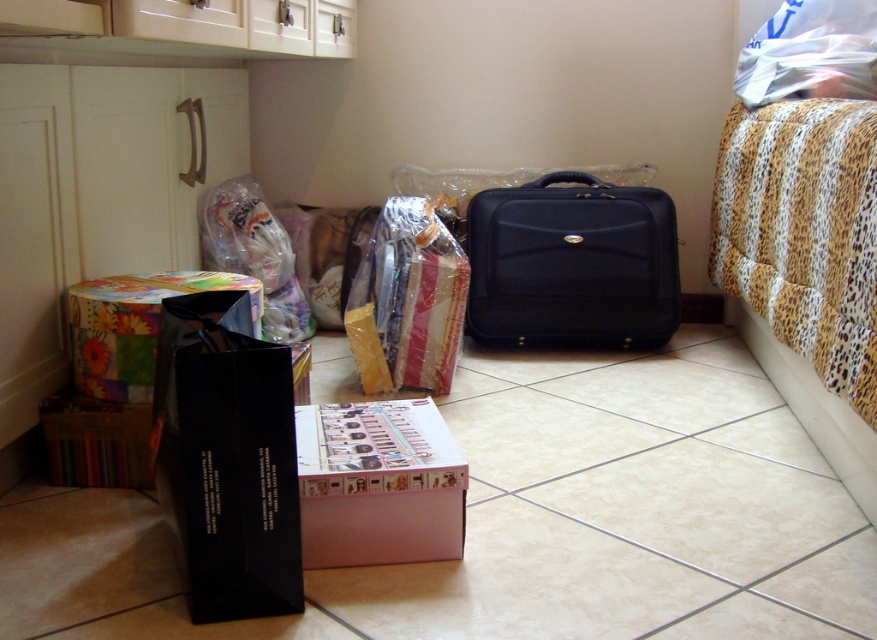
Does black glossy bag at lower left come behind matte cardboard box at lower left?

That is False.

Consider the image. Who is positioned more to the left, black glossy bag at lower left or matte cardboard box at lower left?

Positioned to the left is matte cardboard box at lower left.

The width and height of the screenshot is (877, 640). Describe the element at coordinates (227, 458) in the screenshot. I see `black glossy bag at lower left` at that location.

In order to click on black glossy bag at lower left in this screenshot , I will do `click(227, 458)`.

Does point (298, 339) come behind point (120, 420)?

Yes, point (298, 339) is behind point (120, 420).

Who is positioned more to the right, translucent plastic bag at upper left or matte cardboard box at lower left?

Positioned to the right is translucent plastic bag at upper left.

Find the location of a particular element. This screenshot has width=877, height=640. translucent plastic bag at upper left is located at coordinates (254, 253).

At what (x,y) coordinates should I click in order to perform the action: click on translucent plastic bag at upper left. Please return your answer as a coordinate pair (x, y). Looking at the image, I should click on (254, 253).

Who is lower down, leopard print fabric bed at right or matte black briefcase at center?

leopard print fabric bed at right is lower down.

Who is taller, leopard print fabric bed at right or matte black briefcase at center?

With more height is leopard print fabric bed at right.

Identify the location of leopard print fabric bed at right. The height and width of the screenshot is (640, 877). (804, 266).